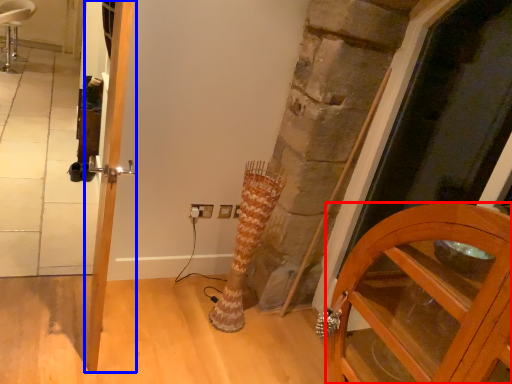
Question: Which object is further to the camera taking this photo, cabinetry (highlighted by a red box) or door (highlighted by a blue box)?

Choices:
 (A) cabinetry
 (B) door

Answer: (B)